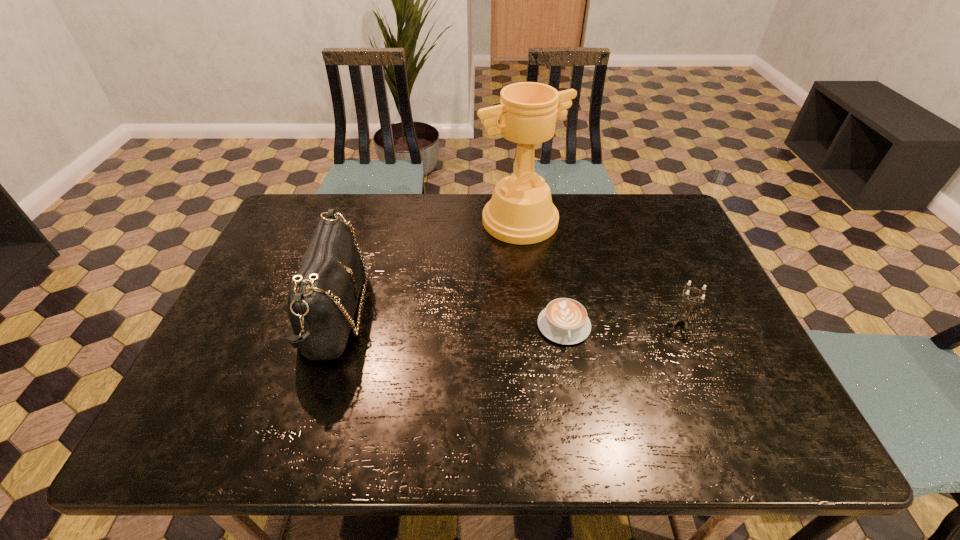
This screenshot has height=540, width=960. In order to click on free location that satisfies the following two spatial constraints: 1. at the front of the rightmost object with chain and zipper; 2. on the left side of the third shortest object in this screenshot , I will do `click(333, 322)`.

The image size is (960, 540). What are the coordinates of `vacant space that satisfies the following two spatial constraints: 1. on the front side of the farthest object; 2. on the right side of the second shortest object` in the screenshot? It's located at (531, 322).

Where is `free space that satisfies the following two spatial constraints: 1. on the back side of the candle holder; 2. at the front of the third shortest object with chain and zipper`? free space that satisfies the following two spatial constraints: 1. on the back side of the candle holder; 2. at the front of the third shortest object with chain and zipper is located at coordinates point(678,314).